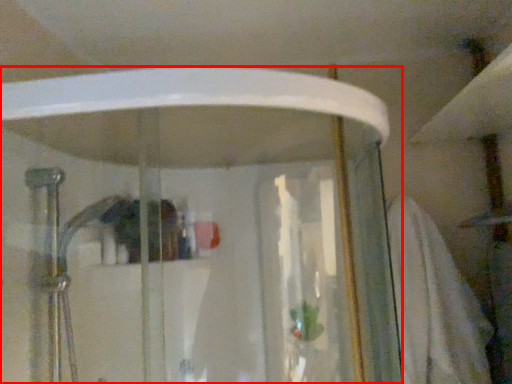
Question: From the image's perspective, considering the relative positions of shower door (annotated by the red box) and bath towel in the image provided, where is shower door (annotated by the red box) located with respect to the staircase?

Choices:
 (A) below
 (B) above

Answer: (B)